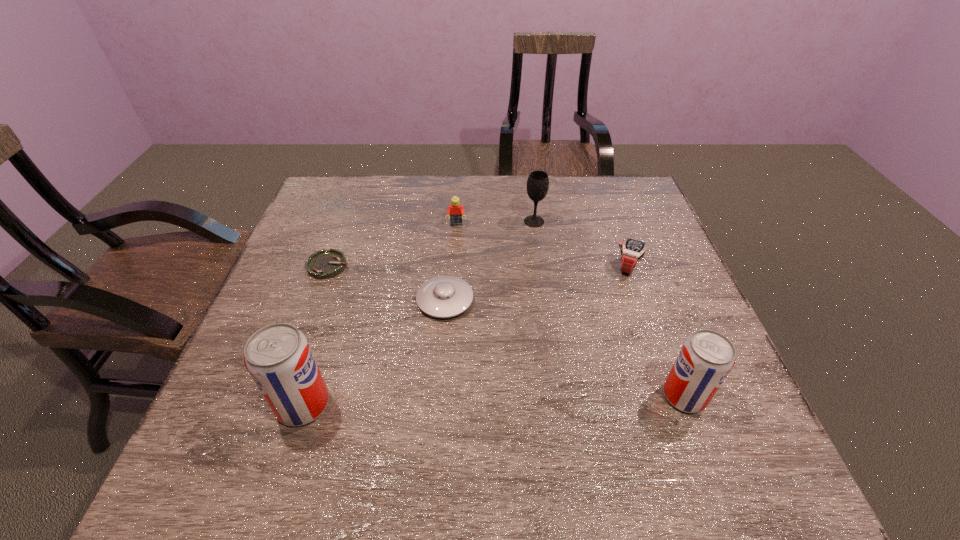
Find the location of a particular element. watch situated at the right edge is located at coordinates (632, 251).

The width and height of the screenshot is (960, 540). I want to click on object located in the near left corner section of the desktop, so click(278, 357).

You are a GUI agent. You are given a task and a screenshot of the screen. Output one action in this format:
    pyautogui.click(x=<x>, y=<y>)
    Task: Click on the object present at the near right corner
    
    Given the screenshot: What is the action you would take?
    pyautogui.click(x=706, y=358)

In the image, there is a desktop. Where is `vacant area at the far edge`? The image size is (960, 540). vacant area at the far edge is located at coordinates (590, 211).

The height and width of the screenshot is (540, 960). In the image, there is a desktop. What are the coordinates of `vacant space at the near edge` in the screenshot? It's located at click(579, 420).

Locate an element on the screen. blank space at the left edge of the desktop is located at coordinates (310, 229).

You are a GUI agent. You are given a task and a screenshot of the screen. Output one action in this format:
    pyautogui.click(x=<x>, y=<y>)
    Task: Click on the free space at the right edge
    Image resolution: width=960 pixels, height=540 pixels.
    Given the screenshot: What is the action you would take?
    pyautogui.click(x=678, y=299)

This screenshot has width=960, height=540. In the image, there is a desktop. In order to click on vacant space at the far left corner in this screenshot , I will do `click(342, 188)`.

You are a GUI agent. You are given a task and a screenshot of the screen. Output one action in this format:
    pyautogui.click(x=<x>, y=<y>)
    Task: Click on the vacant space at the near left corner of the desktop
    
    Given the screenshot: What is the action you would take?
    pyautogui.click(x=260, y=404)

Identify the location of free region at the far right corner of the desktop. (587, 177).